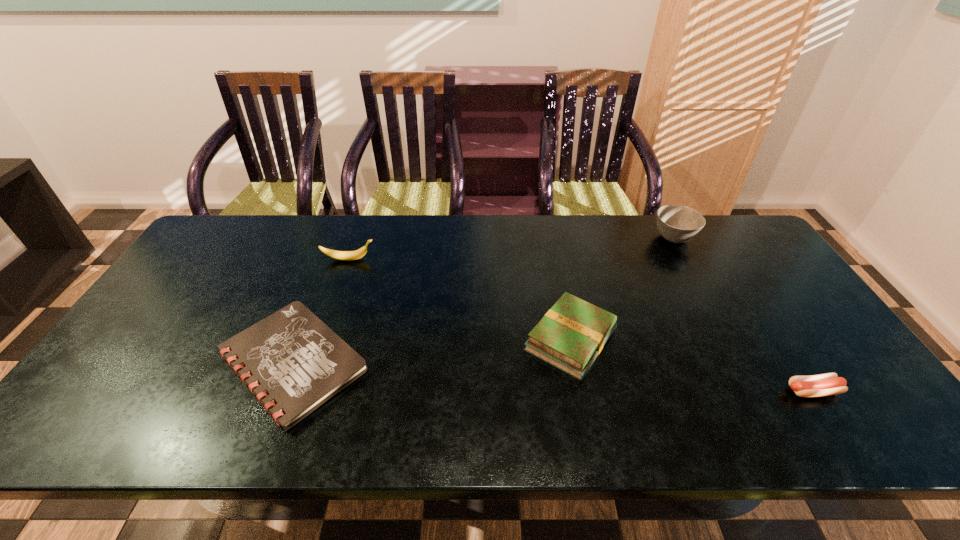
Where is `free space between the farthest object and the shortest object`? This screenshot has width=960, height=540. free space between the farthest object and the shortest object is located at coordinates (483, 300).

The height and width of the screenshot is (540, 960). In order to click on free space between the sausage and the third tallest object in this screenshot , I will do [x=692, y=365].

What are the coordinates of `empty space between the third tallest object and the sausage` in the screenshot? It's located at (692, 365).

Identify the location of vacant area between the third tallest object and the farthest object. (622, 289).

Locate an element on the screen. Image resolution: width=960 pixels, height=540 pixels. unoccupied position between the book and the notebook is located at coordinates (432, 351).

Identify the location of free space between the notebook and the sausage. (553, 377).

Locate an element on the screen. free spot between the notebook and the farthest object is located at coordinates (483, 300).

Find the location of `vacant space that's between the sausage and the shortest object`. vacant space that's between the sausage and the shortest object is located at coordinates (553, 377).

This screenshot has width=960, height=540. Identify the location of blank region between the bowl and the third tallest object. (622, 289).

At what (x,y) coordinates should I click in order to perform the action: click on empty space that is in between the book and the sausage. Please return your answer as a coordinate pair (x, y). Looking at the image, I should click on (692, 365).